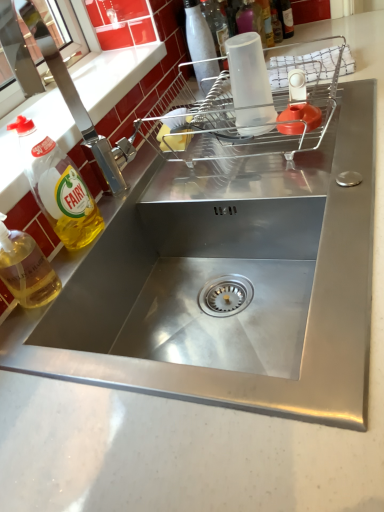
This screenshot has width=384, height=512. What do you see at coordinates (26, 268) in the screenshot? I see `yellow translucent liquid at left, which is the 1th bottle in left-to-right order` at bounding box center [26, 268].

What is the approximate width of brushed metal tap at left?

brushed metal tap at left is 7.73 inches wide.

The image size is (384, 512). Describe the element at coordinates (248, 112) in the screenshot. I see `clear plastic dish rack at upper center` at that location.

What are the coordinates of `translucent plastic bottle at upper right, arranged as the first bottle when viewed from the top` in the screenshot? It's located at (287, 18).

Is the surface of brushed metal tap at left in direct contact with yellow translucent liquid at left, the 4th bottle in the top-to-bottom sequence?

No.

From a real-world perspective, starting from the brushed metal tap at left, which bottle is the 2nd one below it? Please provide its 2D coordinates.

[(58, 186)]

What's the angular difference between brushed metal tap at left and yellow translucent liquid at left, the 2th bottle from the front,'s facing directions?

The angle between the facing direction of brushed metal tap at left and the facing direction of yellow translucent liquid at left, the 2th bottle from the front, is 1.72 degrees.

From their relative heights in the image, would you say brushed metal tap at left is taller or shorter than yellow translucent liquid at left, the second bottle positioned from the bottom?

Considering their sizes, brushed metal tap at left has less height than yellow translucent liquid at left, the second bottle positioned from the bottom.

Find the location of `bottle that is the 3rd one when counting backward from the clear plastic dish rack at upper center`. bottle that is the 3rd one when counting backward from the clear plastic dish rack at upper center is located at coordinates (287, 18).

Considering the sizes of objects clear plastic dish rack at upper center and translucent plastic bottle at upper right, arranged as the fifth bottle when viewed from the left, in the image provided, who is wider, clear plastic dish rack at upper center or translucent plastic bottle at upper right, arranged as the fifth bottle when viewed from the left,?

Wider between the two is clear plastic dish rack at upper center.

What's the angular difference between clear plastic dish rack at upper center and translucent plastic bottle at upper right, arranged as the fifth bottle when ordered from the bottom,'s facing directions?

clear plastic dish rack at upper center and translucent plastic bottle at upper right, arranged as the fifth bottle when ordered from the bottom, are facing 0.829 degrees away from each other.

Between clear plastic dish rack at upper center and translucent plastic bottle at upper right, the 1th bottle from the right, which one appears on the left side from the viewer's perspective?

Positioned to the left is clear plastic dish rack at upper center.

Is white glossy bottle at upper center, the 3th bottle viewed from the right, in front of or behind transparent plastic cup at upper center, the 2th bottle from the right, in the image?

Visually, white glossy bottle at upper center, the 3th bottle viewed from the right, is located in front of transparent plastic cup at upper center, the 2th bottle from the right.

Is white glossy bottle at upper center, the 3th bottle viewed from the right, positioned far away from transparent plastic cup at upper center, the 2th bottle from the right?

No, white glossy bottle at upper center, the 3th bottle viewed from the right, is in close proximity to transparent plastic cup at upper center, the 2th bottle from the right.

Considering the relative sizes of white glossy bottle at upper center, placed as the 3th bottle when sorted from bottom to top, and transparent plastic cup at upper center, which appears as the fourth bottle when viewed from the front, in the image provided, is white glossy bottle at upper center, placed as the 3th bottle when sorted from bottom to top, thinner than transparent plastic cup at upper center, which appears as the fourth bottle when viewed from the front,?

No, white glossy bottle at upper center, placed as the 3th bottle when sorted from bottom to top, is not thinner than transparent plastic cup at upper center, which appears as the fourth bottle when viewed from the front.

From the image's perspective, is white glossy bottle at upper center, which appears as the third bottle when viewed from the front, above or below transparent plastic cup at upper center, the 4th bottle viewed from the left?

From the image's perspective, white glossy bottle at upper center, which appears as the third bottle when viewed from the front, appears below transparent plastic cup at upper center, the 4th bottle viewed from the left.

Can you confirm if clear plastic dish rack at upper center is taller than transparent plastic cup at upper center, marked as the 2th bottle in a top-to-bottom arrangement?

Incorrect, the height of clear plastic dish rack at upper center is not larger of that of transparent plastic cup at upper center, marked as the 2th bottle in a top-to-bottom arrangement.

Does clear plastic dish rack at upper center turn towards transparent plastic cup at upper center, which appears as the fourth bottle when viewed from the front?

No, clear plastic dish rack at upper center is not aimed at transparent plastic cup at upper center, which appears as the fourth bottle when viewed from the front.

Is clear plastic dish rack at upper center wider than transparent plastic cup at upper center, which appears as the fourth bottle when viewed from the front?

Yes, clear plastic dish rack at upper center is wider than transparent plastic cup at upper center, which appears as the fourth bottle when viewed from the front.

From the image's perspective, relative to brushed metal tap at left, is yellow translucent liquid at left, the 4th bottle in the top-to-bottom sequence, above or below?

From the image's perspective, yellow translucent liquid at left, the 4th bottle in the top-to-bottom sequence, appears below brushed metal tap at left.

Is yellow translucent liquid at left, the 2th bottle from the front, to the left of brushed metal tap at left from the viewer's perspective?

No, yellow translucent liquid at left, the 2th bottle from the front, is not to the left of brushed metal tap at left.

How many degrees apart are the facing directions of yellow translucent liquid at left, the 2th bottle from the front, and brushed metal tap at left?

The angular difference between yellow translucent liquid at left, the 2th bottle from the front, and brushed metal tap at left is 1.72 degrees.

Does transparent plastic cup at upper center, the 4th bottle ordered from the bottom, come in front of white glossy bottle at upper center, placed as the 3th bottle when sorted from bottom to top?

No, the depth of transparent plastic cup at upper center, the 4th bottle ordered from the bottom, is greater than that of white glossy bottle at upper center, placed as the 3th bottle when sorted from bottom to top.

Does point (239, 12) come closer to viewer compared to point (197, 3)?

No, it is not.

Who is taller, transparent plastic cup at upper center, placed as the second bottle when sorted from back to front, or white glossy bottle at upper center, the third bottle positioned from the top?

Standing taller between the two is white glossy bottle at upper center, the third bottle positioned from the top.

Does transparent plastic cup at upper center, marked as the 2th bottle in a top-to-bottom arrangement, have a larger size compared to white glossy bottle at upper center, placed as the 3th bottle when sorted from bottom to top?

Indeed, transparent plastic cup at upper center, marked as the 2th bottle in a top-to-bottom arrangement, has a larger size compared to white glossy bottle at upper center, placed as the 3th bottle when sorted from bottom to top.

From the picture: From the image's perspective, which is above, white glossy bottle at upper center, the 3th bottle viewed from the right, or translucent plastic bottle at upper right, which is the 5th bottle in front-to-back order?

translucent plastic bottle at upper right, which is the 5th bottle in front-to-back order, appears higher in the image.

How different are the orientations of white glossy bottle at upper center, the third bottle positioned from the top, and translucent plastic bottle at upper right, arranged as the fifth bottle when ordered from the bottom, in degrees?

white glossy bottle at upper center, the third bottle positioned from the top, and translucent plastic bottle at upper right, arranged as the fifth bottle when ordered from the bottom, are facing 0.00312 degrees away from each other.

Considering the relative sizes of white glossy bottle at upper center, placed as the 3th bottle when sorted from bottom to top, and translucent plastic bottle at upper right, which is the 5th bottle in front-to-back order, in the image provided, is white glossy bottle at upper center, placed as the 3th bottle when sorted from bottom to top, wider than translucent plastic bottle at upper right, which is the 5th bottle in front-to-back order,?

Yes.

Is white glossy bottle at upper center, the third bottle positioned from the left, beside translucent plastic bottle at upper right, the 1th bottle from the right?

They are not placed beside each other.

Image resolution: width=384 pixels, height=512 pixels. In order to click on tap that is above the yellow translucent liquid at left, the fourth bottle viewed from the back (from a real-world perspective) in this screenshot , I will do `click(55, 81)`.

From the image's perspective, count 3rd bottles upward from the clear plastic dish rack at upper center and point to it. Please provide its 2D coordinates.

[(287, 18)]

When comparing their distances from clear plastic dish rack at upper center, does white glossy bottle at upper center, placed as the 3th bottle when sorted from bottom to top, or transparent plastic cup at upper center, marked as the 2th bottle in a top-to-bottom arrangement, seem closer?

white glossy bottle at upper center, placed as the 3th bottle when sorted from bottom to top, is closer to clear plastic dish rack at upper center.

Looking at the image, which one is located further to yellow translucent liquid at left, which is the 1th bottle in left-to-right order, clear plastic dish rack at upper center or white glossy bottle at upper center, placed as the 3th bottle when sorted from bottom to top?

Based on the image, white glossy bottle at upper center, placed as the 3th bottle when sorted from bottom to top, appears to be further to yellow translucent liquid at left, which is the 1th bottle in left-to-right order.

Considering their positions, is white glossy bottle at upper center, the 3th bottle viewed from the right, positioned closer to translucent plastic bottle at upper right, which is the first bottle from back to front, than yellow translucent liquid at left, the second bottle positioned from the bottom?

The object closer to translucent plastic bottle at upper right, which is the first bottle from back to front, is white glossy bottle at upper center, the 3th bottle viewed from the right.

When comparing their distances from yellow translucent liquid at left, the 2th bottle from the left, does white glossy bottle at upper center, the 3th bottle viewed from the right, or clear plastic dish rack at upper center seem closer?

The object closer to yellow translucent liquid at left, the 2th bottle from the left, is clear plastic dish rack at upper center.

When comparing their distances from translucent plastic bottle at upper right, which is the 5th bottle in front-to-back order, does white glossy bottle at upper center, which appears as the third bottle when viewed from the front, or clear plastic dish rack at upper center seem further?

clear plastic dish rack at upper center is further to translucent plastic bottle at upper right, which is the 5th bottle in front-to-back order.

Which object lies further to the anchor point yellow translucent liquid at left, the fourth bottle viewed from the back, clear plastic dish rack at upper center or white glossy bottle at upper center, which appears as the third bottle when viewed from the front?

Among the two, white glossy bottle at upper center, which appears as the third bottle when viewed from the front, is located further to yellow translucent liquid at left, the fourth bottle viewed from the back.

Estimate the real-world distances between objects in this image. Which object is further from yellow translucent liquid at left, placed as the 5th bottle when sorted from back to front, transparent plastic cup at upper center, placed as the second bottle when sorted from back to front, or translucent plastic bottle at upper right, which is the 5th bottle in front-to-back order?

translucent plastic bottle at upper right, which is the 5th bottle in front-to-back order, is further to yellow translucent liquid at left, placed as the 5th bottle when sorted from back to front.

Which object lies further to the anchor point transparent plastic cup at upper center, the 4th bottle ordered from the bottom, brushed metal tap at left or clear plastic dish rack at upper center?

Based on the image, brushed metal tap at left appears to be further to transparent plastic cup at upper center, the 4th bottle ordered from the bottom.

At what (x,y) coordinates should I click in order to perform the action: click on tap between yellow translucent liquid at left, the 2th bottle from the left, and white glossy bottle at upper center, the 3th bottle in the back-to-front sequence, from front to back. Please return your answer as a coordinate pair (x, y). Image resolution: width=384 pixels, height=512 pixels. Looking at the image, I should click on (55, 81).

Where is `bottle positioned between brushed metal tap at left and transparent plastic cup at upper center, placed as the second bottle when sorted from back to front, from near to far`? The width and height of the screenshot is (384, 512). bottle positioned between brushed metal tap at left and transparent plastic cup at upper center, placed as the second bottle when sorted from back to front, from near to far is located at coordinates pyautogui.click(x=200, y=45).

Locate an element on the screen. The image size is (384, 512). appliance between transparent plastic cup at upper center, marked as the 2th bottle in a top-to-bottom arrangement, and yellow translucent liquid at left, positioned as the 5th bottle in right-to-left order, vertically is located at coordinates (248, 112).

The width and height of the screenshot is (384, 512). Find the location of `tap between white glossy bottle at upper center, the third bottle positioned from the top, and yellow translucent liquid at left, which appears as the 1th bottle when viewed from the front, in the vertical direction`. tap between white glossy bottle at upper center, the third bottle positioned from the top, and yellow translucent liquid at left, which appears as the 1th bottle when viewed from the front, in the vertical direction is located at coordinates (55, 81).